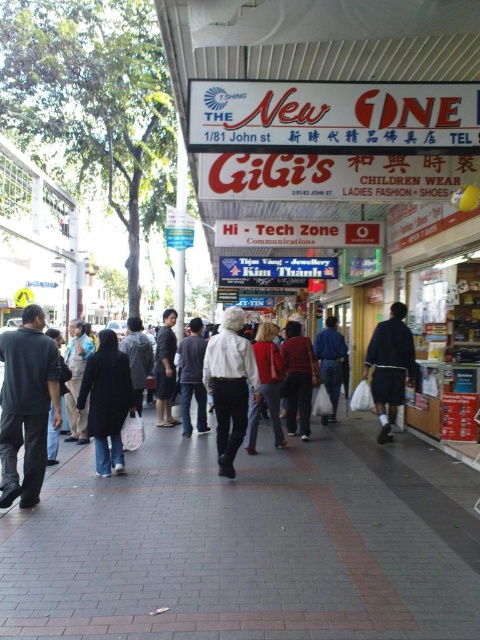
I want to click on white matte shirt at center, so click(x=229, y=385).

Does white matte shirt at center appear over dark gray sweater at center?

Indeed, white matte shirt at center is positioned over dark gray sweater at center.

Between point (233, 454) and point (196, 360), which one is positioned behind?

Positioned behind is point (196, 360).

At what (x,y) coordinates should I click in order to perform the action: click on white matte shirt at center. Please return your answer as a coordinate pair (x, y). Looking at the image, I should click on (229, 385).

Does dark blue fabric coat at center appear on the right side of dark gray fabric jacket at center?

No, dark blue fabric coat at center is not to the right of dark gray fabric jacket at center.

Who is more forward, (88,365) or (167,369)?

Positioned in front is point (88,365).

Who is more distant from viewer, [104,452] or [163,385]?

Positioned behind is point [163,385].

At what (x,y) coordinates should I click in order to perform the action: click on dark blue fabric coat at center. Please return your answer as a coordinate pair (x, y). Looking at the image, I should click on (107, 401).

Between point (223, 426) and point (310, 432), which one is positioned behind?

The point (310, 432) is more distant.

Is white matte shirt at center smaller than matte red sweater at center?

Yes.

Between point (206, 356) and point (300, 358), which one is positioned behind?

Point (300, 358)

Identify the location of white matte shirt at center. (229, 385).